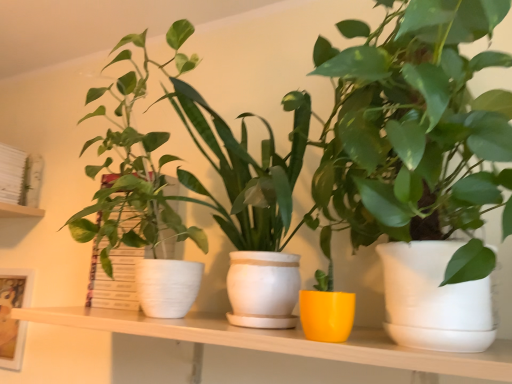
Where is `matte white shelf at center`? The image size is (512, 384). matte white shelf at center is located at coordinates (282, 342).

The image size is (512, 384). What do you see at coordinates (282, 342) in the screenshot? I see `matte white shelf at center` at bounding box center [282, 342].

What is the approximate width of yellow matte pot at center, which is the second houseplant in right-to-left order?

yellow matte pot at center, which is the second houseplant in right-to-left order, is 3.74 inches wide.

This screenshot has width=512, height=384. Describe the element at coordinates (19, 183) in the screenshot. I see `white matte bookshelf at upper left` at that location.

Find the location of a particular element. matte white pot at center, which is the first houseplant from right to left is located at coordinates (419, 163).

Image resolution: width=512 pixels, height=384 pixels. What do you see at coordinates (10, 316) in the screenshot? I see `matte white picture frame at left` at bounding box center [10, 316].

This screenshot has height=384, width=512. Find the location of `matte white shelf at center`. matte white shelf at center is located at coordinates (282, 342).

From the image's perspective, is matte white picture frame at left under matte white shelf at center?

Yes.

Does matte white picture frame at left have a greater width compared to matte white shelf at center?

No, matte white picture frame at left is not wider than matte white shelf at center.

Is matte white picture frame at left far away from matte white shelf at center?

No.

Is yellow matte pot at center, which is the second houseplant in right-to-left order, completely or partially inside matte white picture frame at left?

No, yellow matte pot at center, which is the second houseplant in right-to-left order, is located outside of matte white picture frame at left.

Considering the relative sizes of matte white picture frame at left and yellow matte pot at center, which is the second houseplant in right-to-left order, in the image provided, is matte white picture frame at left shorter than yellow matte pot at center, which is the second houseplant in right-to-left order,?

No, matte white picture frame at left is not shorter than yellow matte pot at center, which is the second houseplant in right-to-left order.

Is matte white picture frame at left aimed at yellow matte pot at center, which is the second houseplant in right-to-left order?

No, matte white picture frame at left is not oriented towards yellow matte pot at center, which is the second houseplant in right-to-left order.

From the image's perspective, between matte white picture frame at left and yellow matte pot at center, which is the second houseplant in right-to-left order, who is located below?

From the image's view, matte white picture frame at left is below.

Looking at this image, can you confirm if matte white picture frame at left is taller than white matte bookshelf at upper left?

Indeed, matte white picture frame at left has a greater height compared to white matte bookshelf at upper left.

Are matte white picture frame at left and white matte bookshelf at upper left located far from each other?

No, matte white picture frame at left is in close proximity to white matte bookshelf at upper left.

Would you say matte white picture frame at left is outside white matte bookshelf at upper left?

matte white picture frame at left lies outside white matte bookshelf at upper left's area.

Does matte white picture frame at left have a greater width compared to white matte bookshelf at upper left?

No.

Is matte white pot at left, which is the 3th houseplant in right-to-left order, positioned with its back to yellow matte pot at center, positioned as the second houseplant in left-to-right order?

No, matte white pot at left, which is the 3th houseplant in right-to-left order, is not facing the opposite direction of yellow matte pot at center, positioned as the second houseplant in left-to-right order.

Is matte white pot at left, the first houseplant in the left-to-right sequence, in contact with yellow matte pot at center, positioned as the second houseplant in left-to-right order?

No.

Is matte white pot at left, the first houseplant in the left-to-right sequence, not within yellow matte pot at center, which is the second houseplant in right-to-left order?

Indeed, matte white pot at left, the first houseplant in the left-to-right sequence, is completely outside yellow matte pot at center, which is the second houseplant in right-to-left order.

Considering the relative sizes of matte white pot at left, which is the 3th houseplant in right-to-left order, and yellow matte pot at center, positioned as the second houseplant in left-to-right order, in the image provided, is matte white pot at left, which is the 3th houseplant in right-to-left order, wider than yellow matte pot at center, positioned as the second houseplant in left-to-right order,?

Yes, matte white pot at left, which is the 3th houseplant in right-to-left order, is wider than yellow matte pot at center, positioned as the second houseplant in left-to-right order.

Can matte white pot at center, which is the first houseplant from right to left, be found inside matte white shelf at center?

No, matte white pot at center, which is the first houseplant from right to left, is located outside of matte white shelf at center.

Are matte white shelf at center and matte white pot at center, placed as the third houseplant when sorted from left to right, beside each other?

There is a gap between matte white shelf at center and matte white pot at center, placed as the third houseplant when sorted from left to right.

From the image's perspective, starting from the matte white shelf at center, which houseplant is the 3rd one above? Please provide its 2D coordinates.

[(419, 163)]

From the image's perspective, which one is positioned lower, matte white shelf at center or matte white pot at center, which is the first houseplant from right to left?

matte white shelf at center.

Is matte white pot at center, which is the first houseplant from right to left, bigger or smaller than white matte bookshelf at upper left?

matte white pot at center, which is the first houseplant from right to left, is bigger than white matte bookshelf at upper left.

Considering the positions of objects matte white pot at center, which is the first houseplant from right to left, and white matte bookshelf at upper left in the image provided, who is in front, matte white pot at center, which is the first houseplant from right to left, or white matte bookshelf at upper left?

Positioned in front is matte white pot at center, which is the first houseplant from right to left.

Is matte white pot at center, which is the first houseplant from right to left, far from white matte bookshelf at upper left?

That's right, there is a large distance between matte white pot at center, which is the first houseplant from right to left, and white matte bookshelf at upper left.

Is point (465, 323) farther from viewer compared to point (0, 150)?

That is False.

Based on the photo, which is behind, matte white pot at center, which is the first houseplant from right to left, or matte white shelf at center?

matte white shelf at center is further from the camera.

Based on the photo, from a real-world perspective, is matte white pot at center, which is the first houseplant from right to left, located beneath matte white shelf at center?

Incorrect, from a real-world perspective, matte white pot at center, which is the first houseplant from right to left, is higher than matte white shelf at center.

Is there a large distance between matte white pot at center, which is the first houseplant from right to left, and matte white shelf at center?

No.

This screenshot has height=384, width=512. I want to click on picture frame below the matte white shelf at center (from the image's perspective), so click(x=10, y=316).

Find the location of a particular element. The image size is (512, 384). the 1st houseplant above when counting from the matte white picture frame at left (from the image's perspective) is located at coordinates (326, 303).

Looking at the image, which one is located further to matte white picture frame at left, yellow matte pot at center, which is the second houseplant in right-to-left order, or matte white pot at left, the first houseplant in the left-to-right sequence?

yellow matte pot at center, which is the second houseplant in right-to-left order, lies further to matte white picture frame at left than the other object.

Looking at the image, which one is located closer to matte white pot at left, the first houseplant in the left-to-right sequence, matte white picture frame at left or matte white pot at center, which is the first houseplant from right to left?

matte white pot at center, which is the first houseplant from right to left, is positioned closer to the anchor matte white pot at left, the first houseplant in the left-to-right sequence.

From the image, which object appears to be nearer to matte white pot at left, the first houseplant in the left-to-right sequence, yellow matte pot at center, positioned as the second houseplant in left-to-right order, or white matte bookshelf at upper left?

yellow matte pot at center, positioned as the second houseplant in left-to-right order, lies closer to matte white pot at left, the first houseplant in the left-to-right sequence, than the other object.

Based on their spatial positions, is matte white picture frame at left or matte white pot at left, the first houseplant in the left-to-right sequence, closer to matte white shelf at center?

matte white pot at left, the first houseplant in the left-to-right sequence.

Estimate the real-world distances between objects in this image. Which object is closer to matte white pot at left, which is the 3th houseplant in right-to-left order, yellow matte pot at center, positioned as the second houseplant in left-to-right order, or matte white shelf at center?

The object closer to matte white pot at left, which is the 3th houseplant in right-to-left order, is matte white shelf at center.

Estimate the real-world distances between objects in this image. Which object is further from matte white shelf at center, matte white pot at left, which is the 3th houseplant in right-to-left order, or white matte bookshelf at upper left?

Among the two, white matte bookshelf at upper left is located further to matte white shelf at center.

From the image, which object appears to be nearer to white matte bookshelf at upper left, matte white shelf at center or matte white pot at center, placed as the third houseplant when sorted from left to right?

The object closer to white matte bookshelf at upper left is matte white shelf at center.

Considering their positions, is matte white picture frame at left positioned further to matte white pot at center, placed as the third houseplant when sorted from left to right, than white matte bookshelf at upper left?

white matte bookshelf at upper left is further to matte white pot at center, placed as the third houseplant when sorted from left to right.

Identify the location of houseplant between matte white pot at left, which is the 3th houseplant in right-to-left order, and matte white pot at center, placed as the third houseplant when sorted from left to right, from left to right. Image resolution: width=512 pixels, height=384 pixels. (326, 303).

Locate an element on the screen. This screenshot has height=384, width=512. table positioned between matte white pot at center, which is the first houseplant from right to left, and white matte bookshelf at upper left from near to far is located at coordinates (282, 342).

I want to click on picture frame between matte white pot at left, which is the 3th houseplant in right-to-left order, and white matte bookshelf at upper left in the front-back direction, so click(10, 316).

You are a GUI agent. You are given a task and a screenshot of the screen. Output one action in this format:
    pyautogui.click(x=<x>, y=<y>)
    Task: Click on the shelf between matte white picture frame at left and yellow matte pot at center, which is the second houseplant in right-to-left order, from left to right
    This screenshot has height=384, width=512.
    Given the screenshot: What is the action you would take?
    19,183